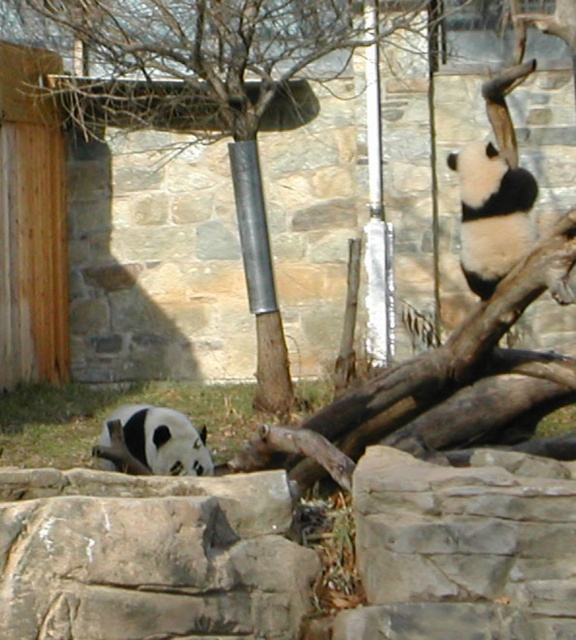
You are a zookeeper standing at the entrance of the enclosure and want to observe both points in the scene. Which point is closer to you, point [177,131] or point [166,456]?

Point [177,131] is further to the viewer than point [166,456], so point [166,456] is closer to you.

You are a zookeeper observing the pandas in their enclosure. You notice the smooth brown tree trunk at center and the black and white fur panda at lower left. Which object is taller?

The smooth brown tree trunk at center is taller than the black and white fur panda at lower left.